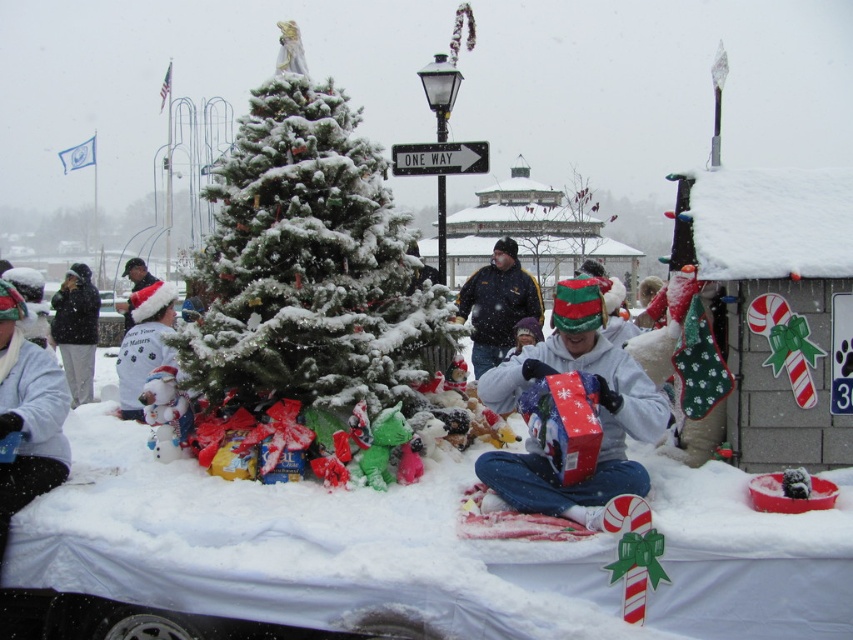
Does white fleece jacket at lower left appear on the left side of black fleece jacket at left?

In fact, white fleece jacket at lower left is to the right of black fleece jacket at left.

Can you confirm if white fleece jacket at lower left is bigger than black fleece jacket at left?

Incorrect, white fleece jacket at lower left is not larger than black fleece jacket at left.

Is point (4, 508) positioned after point (56, 305)?

No.

Where is `white fleece jacket at lower left`? white fleece jacket at lower left is located at coordinates (28, 413).

Which of these two, matte white gift at center or dark blue jacket at center, stands taller?

With more height is dark blue jacket at center.

Between matte white gift at center and dark blue jacket at center, which one appears on the right side from the viewer's perspective?

dark blue jacket at center

I want to click on matte white gift at center, so click(x=596, y=412).

How distant is matte white gift at center from white fleece jacket at lower left?

They are 8.36 feet apart.

Locate an element on the screen. The height and width of the screenshot is (640, 853). matte white gift at center is located at coordinates (596, 412).

Is point (519, 502) closer to camera compared to point (57, 472)?

Yes, point (519, 502) is in front of point (57, 472).

Find the location of `matte white gift at center`. matte white gift at center is located at coordinates (596, 412).